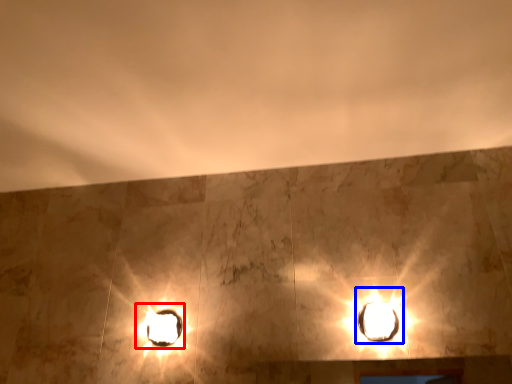
Question: Which object appears closest to the camera in this image, stage light (highlighted by a red box) or lamp (highlighted by a blue box)?

Choices:
 (A) stage light
 (B) lamp

Answer: (B)